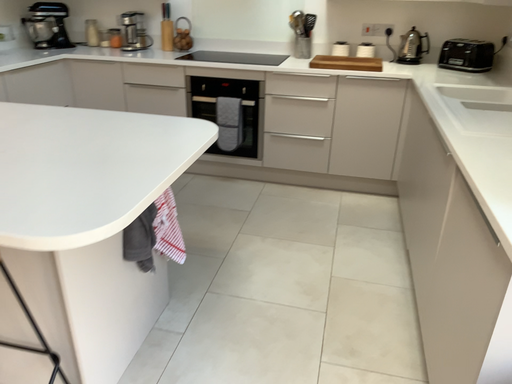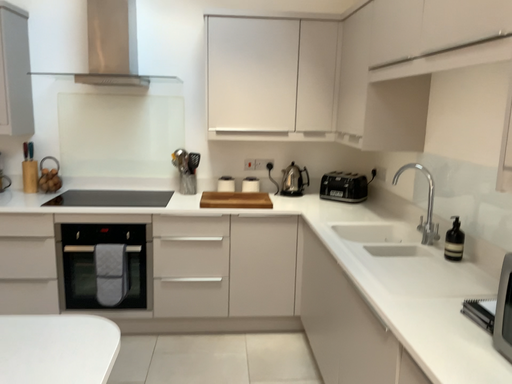
Question: How did the camera likely rotate when shooting the video?

Choices:
 (A) rotated right
 (B) rotated left

Answer: (A)